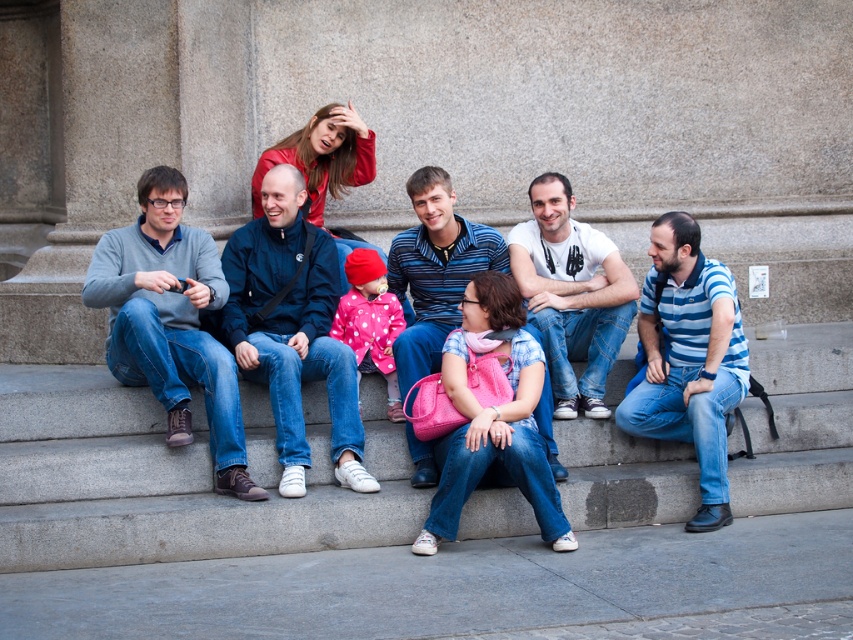
You are a photographer trying to capture a group photo of the gray sweater at left and the blue striped polo shirt at center. Which person should you position closer to the camera to ensure both appear equally tall in the photo?

Since the gray sweater at left is much taller than the blue striped polo shirt at center, you should position the blue striped polo shirt at center closer to the camera to balance their heights in the photo.

You are trying to locate the person wearing the gray sweater at left in a group photo. Which direction should you look relative to the blue striped polo shirt at center?

The gray sweater at left is positioned on the left side of the blue striped polo shirt at center, so you should look to the left of the blue striped polo shirt at center to find the gray sweater at left.